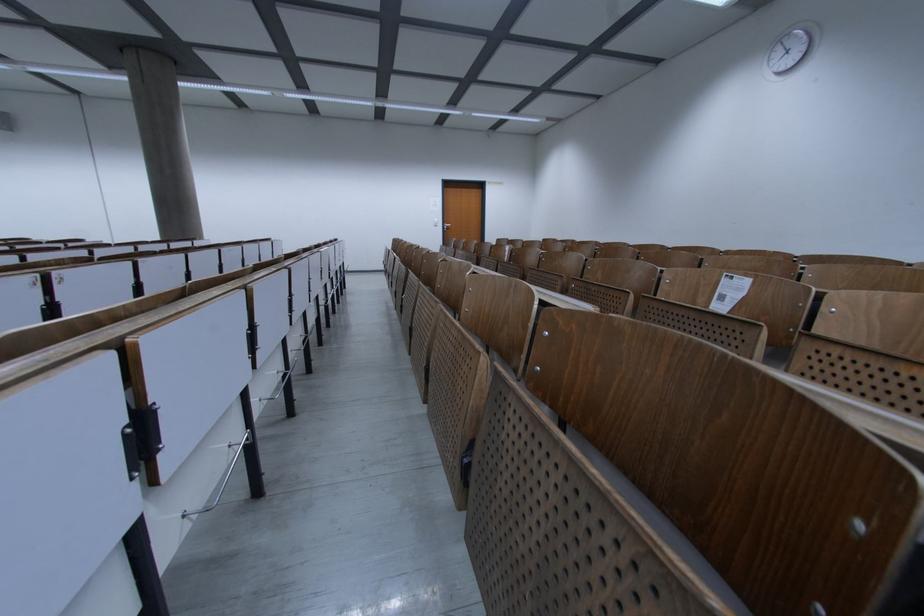
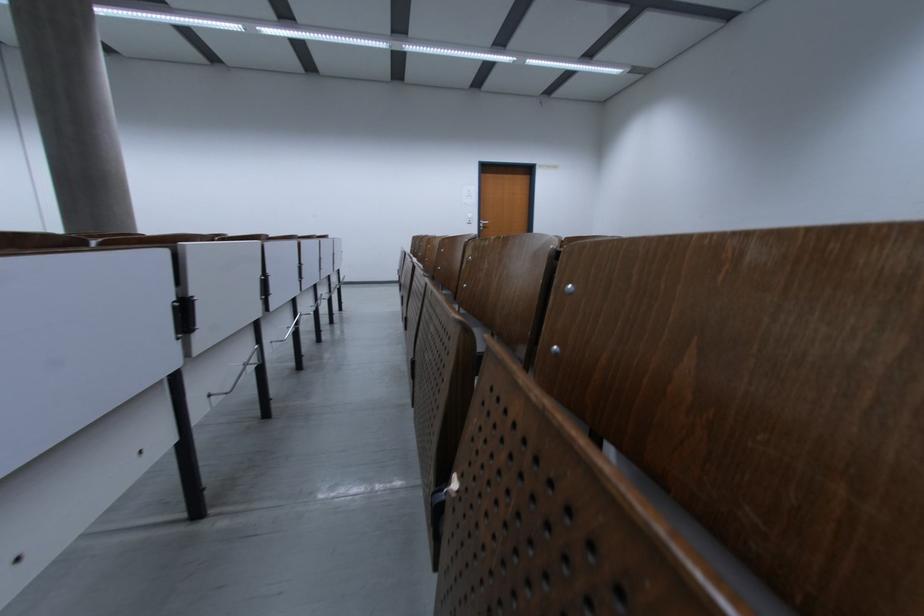
Where in the second image is the point corresponding to pixel 438 208 from the first image?

(470, 199)